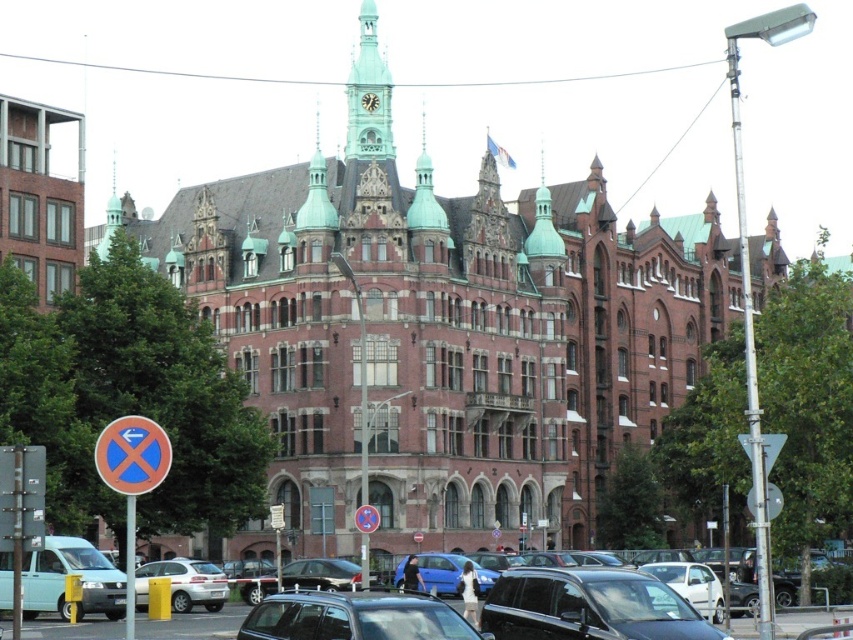
Can you confirm if metallic silver car at center is thinner than blue circular sign at left?

No.

Is metallic silver car at center bigger than blue circular sign at left?

Yes, metallic silver car at center is bigger than blue circular sign at left.

Describe the element at coordinates (354, 618) in the screenshot. I see `metallic silver car at center` at that location.

You are a GUI agent. You are given a task and a screenshot of the screen. Output one action in this format:
    pyautogui.click(x=<x>, y=<y>)
    Task: Click on the metallic silver car at center
    This screenshot has height=640, width=853.
    Given the screenshot: What is the action you would take?
    pyautogui.click(x=354, y=618)

Who is lower down, metallic silver car at center or red circular sign at center?

metallic silver car at center is below.

Can you confirm if metallic silver car at center is positioned to the right of red circular sign at center?

Yes, metallic silver car at center is to the right of red circular sign at center.

Where is `metallic silver car at center`? Image resolution: width=853 pixels, height=640 pixels. metallic silver car at center is located at coordinates (354, 618).

I want to click on metallic silver car at center, so click(x=354, y=618).

Measure the distance between point (300, 636) and camera.

A distance of 51.90 meters exists between point (300, 636) and camera.

Does metallic silver car at center come in front of silver metallic sedan at lower center?

Yes, metallic silver car at center is closer to the viewer.

Between point (334, 620) and point (155, 572), which one is positioned behind?

Positioned behind is point (155, 572).

Image resolution: width=853 pixels, height=640 pixels. In order to click on metallic silver car at center in this screenshot , I will do `click(354, 618)`.